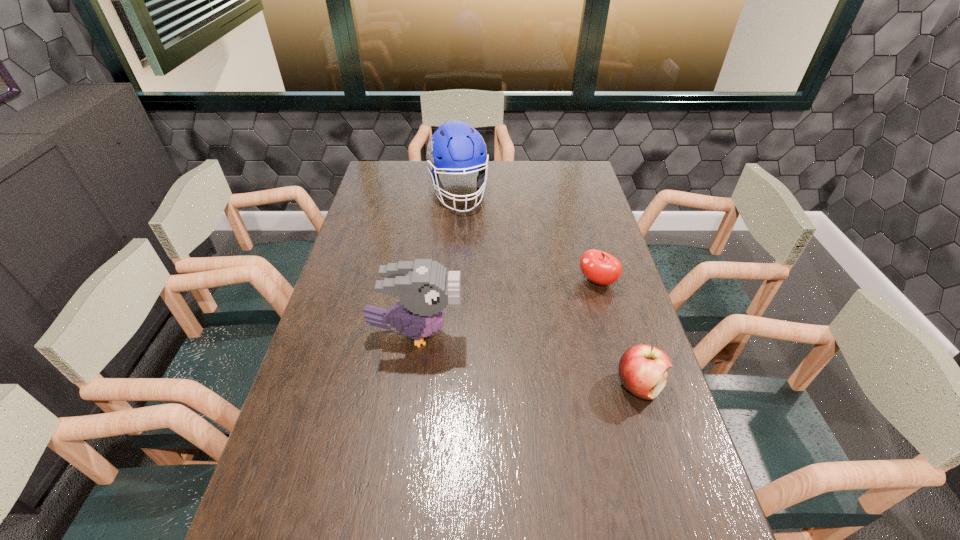
Locate an element on the screen. The width and height of the screenshot is (960, 540). vacant position at the far right corner of the desktop is located at coordinates (580, 181).

What are the coordinates of `free space between the nearer apple and the bird` in the screenshot? It's located at (527, 360).

Locate an element on the screen. Image resolution: width=960 pixels, height=540 pixels. free spot between the football helmet and the third nearest object is located at coordinates (528, 237).

The height and width of the screenshot is (540, 960). Find the location of `free space between the second tallest object and the third nearest object`. free space between the second tallest object and the third nearest object is located at coordinates (506, 307).

I want to click on free space between the third shortest object and the farther apple, so click(x=506, y=307).

I want to click on free spot between the farther apple and the second tallest object, so click(506, 307).

Image resolution: width=960 pixels, height=540 pixels. I want to click on free space between the nearer apple and the second tallest object, so click(527, 360).

Find the location of a particular element. The width and height of the screenshot is (960, 540). unoccupied area between the nearest object and the third shortest object is located at coordinates (527, 360).

This screenshot has width=960, height=540. Find the location of `the second closest object to the farthest object`. the second closest object to the farthest object is located at coordinates (424, 287).

The image size is (960, 540). Find the location of `the third closest object to the second nearest object`. the third closest object to the second nearest object is located at coordinates (455, 147).